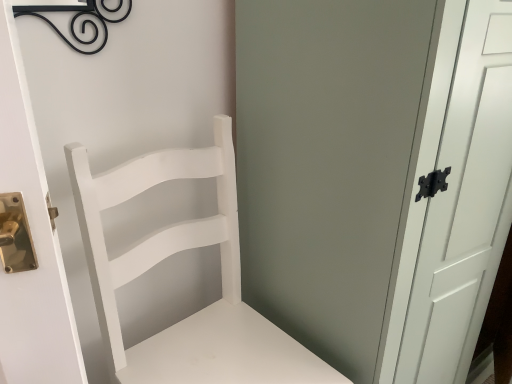
Question: Should I look upward or downward to see white matte screen door at center?

Choices:
 (A) down
 (B) up

Answer: (A)

Question: Is white matte screen door at center positioned beyond the bounds of white matte wood chair at center?

Choices:
 (A) no
 (B) yes

Answer: (B)

Question: Does white matte screen door at center have a greater width compared to white matte wood chair at center?

Choices:
 (A) yes
 (B) no

Answer: (A)

Question: Considering the relative positions of white matte screen door at center and white matte wood chair at center in the image provided, is white matte screen door at center to the left of white matte wood chair at center from the viewer's perspective?

Choices:
 (A) yes
 (B) no

Answer: (B)

Question: Can you confirm if white matte screen door at center is smaller than white matte wood chair at center?

Choices:
 (A) yes
 (B) no

Answer: (B)

Question: Is white matte screen door at center in contact with white matte wood chair at center?

Choices:
 (A) yes
 (B) no

Answer: (B)

Question: Is white matte wood chair at center completely or partially inside white matte screen door at center?

Choices:
 (A) yes
 (B) no

Answer: (B)

Question: Is white matte wood chair at center at the right side of white matte screen door at center?

Choices:
 (A) no
 (B) yes

Answer: (A)

Question: Is white matte wood chair at center positioned with its back to white matte screen door at center?

Choices:
 (A) no
 (B) yes

Answer: (A)

Question: Does white matte wood chair at center appear on the left side of white matte screen door at center?

Choices:
 (A) yes
 (B) no

Answer: (A)

Question: Could you tell me if white matte wood chair at center is turned towards white matte screen door at center?

Choices:
 (A) no
 (B) yes

Answer: (A)

Question: From a real-world perspective, is white matte wood chair at center physically below white matte screen door at center?

Choices:
 (A) no
 (B) yes

Answer: (B)

Question: Can you confirm if white matte wood chair at center is wider than white matte screen door at center?

Choices:
 (A) no
 (B) yes

Answer: (A)

Question: Is white matte screen door at center in front of or behind white matte wood chair at center in the image?

Choices:
 (A) behind
 (B) front

Answer: (A)